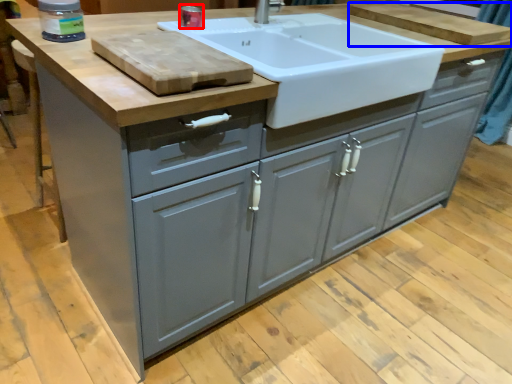
Question: Which object is further to the camera taking this photo, appliance (highlighted by a red box) or cutting board (highlighted by a blue box)?

Choices:
 (A) appliance
 (B) cutting board

Answer: (B)